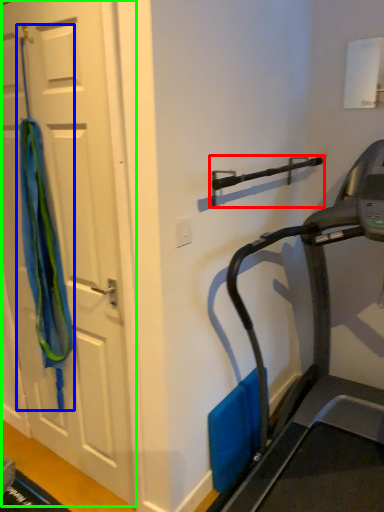
Question: Based on their relative distances, which object is nearer to door handle (highlighted by a red box)? Choose from curtain (highlighted by a blue box) and door (highlighted by a green box).

Choices:
 (A) curtain
 (B) door

Answer: (B)